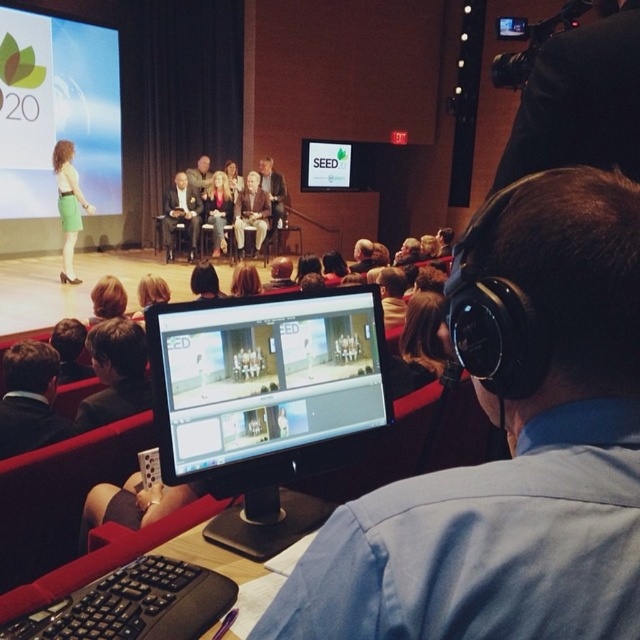
You are a fashion designer analyzing the clothing in the image. Which clothing item, the matte black suit at center or the light brown leather jacket at center, has a wider silhouette?

The matte black suit at center has a wider silhouette than the light brown leather jacket at center.

You are a stagehand who needs to retrieve a dark brown leather jacket at lower left. The stage is located at the upper part of the image. To reach the jacket, should you move towards the lower or upper part of the image?

The dark brown leather jacket at lower left is located at point (29, 400), which is closer to the lower part of the image. Therefore, to retrieve it, you should move towards the lower part of the image.

You are an event coordinator who needs to seat two VIP guests. There are two seats available at the center of the audience area. One seat is to the left of the other. Which seat should you assign to the guest wearing the matte black suit at center if you want them to be seated to the left of the guest in the light brown leather jacket at center?

The matte black suit at center is already positioned to the left of the light brown leather jacket at center. Therefore, you should assign the seat to the left to the guest in the matte black suit at center so they are seated to the left of the guest in the light brown leather jacket at center.